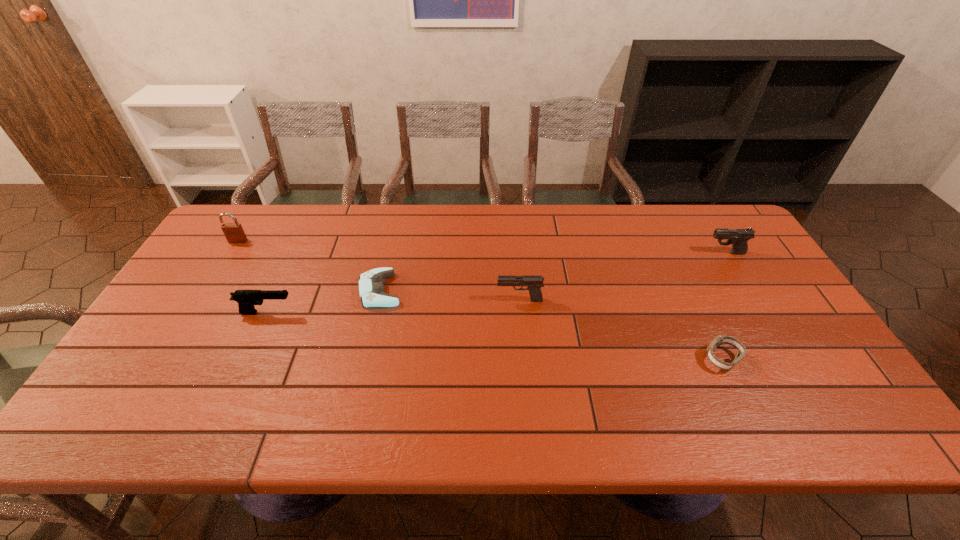
In the image, there is a desktop. At what (x,y) coordinates should I click in order to perform the action: click on vacant space at the left edge. Please return your answer as a coordinate pair (x, y). This screenshot has width=960, height=540. Looking at the image, I should click on (202, 286).

This screenshot has height=540, width=960. Identify the location of free spot at the right edge of the desktop. (791, 328).

Locate an element on the screen. vacant space at the far left corner of the desktop is located at coordinates (233, 247).

Find the location of a particular element. This screenshot has height=540, width=960. vacant space at the near left corner of the desktop is located at coordinates (84, 431).

Locate an element on the screen. vacant region at the far right corner of the desktop is located at coordinates (723, 209).

The width and height of the screenshot is (960, 540). I want to click on free space between the farthest pistol and the farthest object, so click(x=482, y=247).

Where is `free spot between the rightmost pistol and the padlock`? Image resolution: width=960 pixels, height=540 pixels. free spot between the rightmost pistol and the padlock is located at coordinates (482, 247).

Find the location of `vacant area between the watch and the farthest pistol`. vacant area between the watch and the farthest pistol is located at coordinates (724, 306).

The height and width of the screenshot is (540, 960). Find the location of `vacant area that lies between the fifth nearest object and the second pistol from right to left`. vacant area that lies between the fifth nearest object and the second pistol from right to left is located at coordinates (623, 276).

Where is `free space between the padlock and the nearest object`? free space between the padlock and the nearest object is located at coordinates (480, 300).